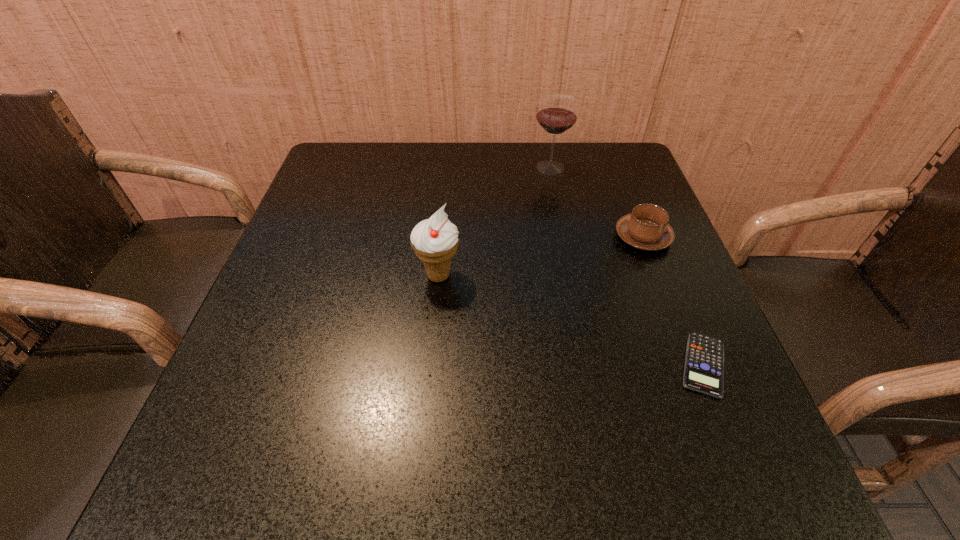
The width and height of the screenshot is (960, 540). What are the coordinates of `wineglass` in the screenshot? It's located at (557, 113).

Locate an element on the screen. This screenshot has height=540, width=960. the farthest object is located at coordinates (557, 113).

At what (x,y) coordinates should I click in order to perform the action: click on icecream. Please return your answer as a coordinate pair (x, y). Looking at the image, I should click on (435, 240).

Where is `the leftmost object`? The height and width of the screenshot is (540, 960). the leftmost object is located at coordinates (435, 240).

Where is `the second shortest object`? The image size is (960, 540). the second shortest object is located at coordinates (646, 228).

Locate an element on the screen. The image size is (960, 540). cappuccino is located at coordinates (646, 228).

Locate an element on the screen. The image size is (960, 540). calculator is located at coordinates (704, 362).

Locate an element on the screen. This screenshot has width=960, height=540. the shortest object is located at coordinates (704, 362).

Where is `free point located on the left of the third object from right to left`? The height and width of the screenshot is (540, 960). free point located on the left of the third object from right to left is located at coordinates (446, 167).

Locate an element on the screen. free space located 0.230m on the left of the leftmost object is located at coordinates (300, 275).